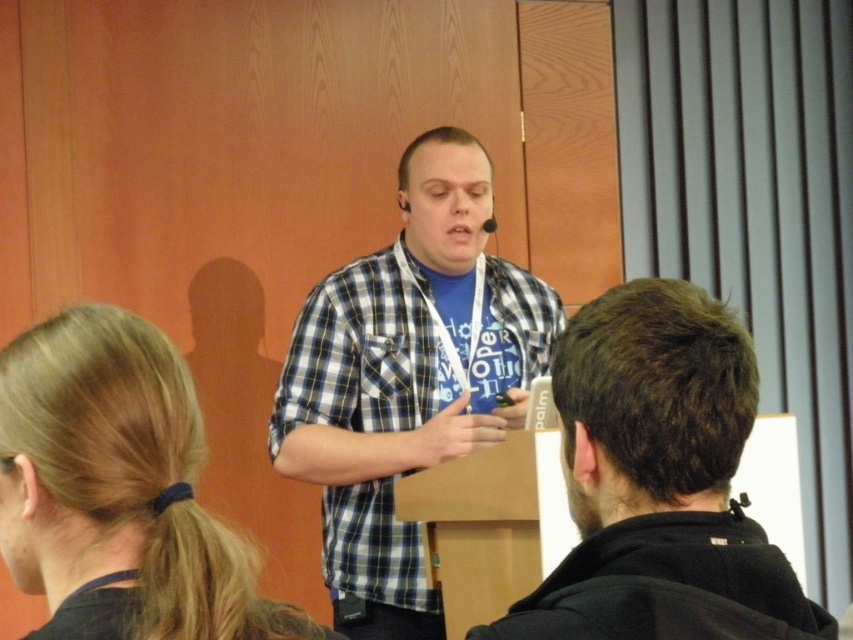
Question: Does black cotton shirt at center appear under blonde hair at lower left?

Choices:
 (A) yes
 (B) no

Answer: (B)

Question: Which point is closer to the camera?

Choices:
 (A) blonde hair at lower left
 (B) checkered fabric shirt at center

Answer: (A)

Question: Estimate the real-world distances between objects in this image. Which object is farther from the checkered fabric shirt at center?

Choices:
 (A) blonde hair at lower left
 (B) black cotton shirt at center

Answer: (A)

Question: Where is black cotton shirt at center located in relation to blonde hair at lower left in the image?

Choices:
 (A) below
 (B) above

Answer: (B)

Question: Can you confirm if checkered fabric shirt at center is wider than blonde hair at lower left?

Choices:
 (A) yes
 (B) no

Answer: (A)

Question: Which point is closer to the camera?

Choices:
 (A) (613, 620)
 (B) (425, 406)

Answer: (A)